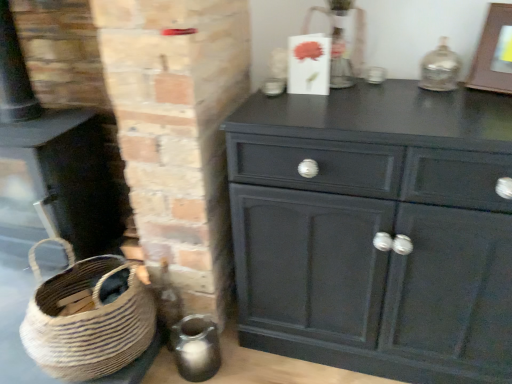
Question: Do you think wooden picture frame at upper right is within natural woven basket at lower left, or outside of it?

Choices:
 (A) inside
 (B) outside

Answer: (B)

Question: From a real-world perspective, is wooden picture frame at upper right positioned above or below natural woven basket at lower left?

Choices:
 (A) below
 (B) above

Answer: (B)

Question: Estimate the real-world distances between objects in this image. Which object is closer to the matte black cabinet at center?

Choices:
 (A) natural woven basket at lower left
 (B) matte black fireplace at lower left
 (C) wooden picture frame at upper right

Answer: (C)

Question: Estimate the real-world distances between objects in this image. Which object is closer to the natural woven basket at lower left?

Choices:
 (A) matte black cabinet at center
 (B) wooden picture frame at upper right
 (C) matte black fireplace at lower left

Answer: (C)